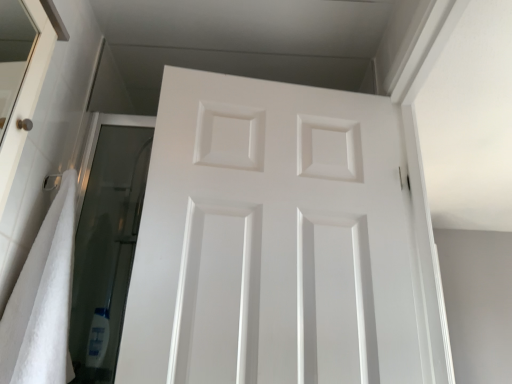
Question: Looking at their shapes, would you say white matte door at center is wider or thinner than white soft towel at left?

Choices:
 (A) thin
 (B) wide

Answer: (A)

Question: Considering the relative positions of white matte door at center and white soft towel at left in the image provided, is white matte door at center to the left or to the right of white soft towel at left?

Choices:
 (A) left
 (B) right

Answer: (B)

Question: Does point (124, 364) appear closer or farther from the camera than point (26, 332)?

Choices:
 (A) closer
 (B) farther

Answer: (B)

Question: Is white soft towel at left bigger or smaller than white matte door at center?

Choices:
 (A) big
 (B) small

Answer: (B)

Question: From the image's perspective, is white soft towel at left above or below white matte door at center?

Choices:
 (A) below
 (B) above

Answer: (A)

Question: From a real-world perspective, is white soft towel at left above or below white matte door at center?

Choices:
 (A) below
 (B) above

Answer: (A)

Question: Is white soft towel at left spatially inside white matte door at center, or outside of it?

Choices:
 (A) outside
 (B) inside

Answer: (A)